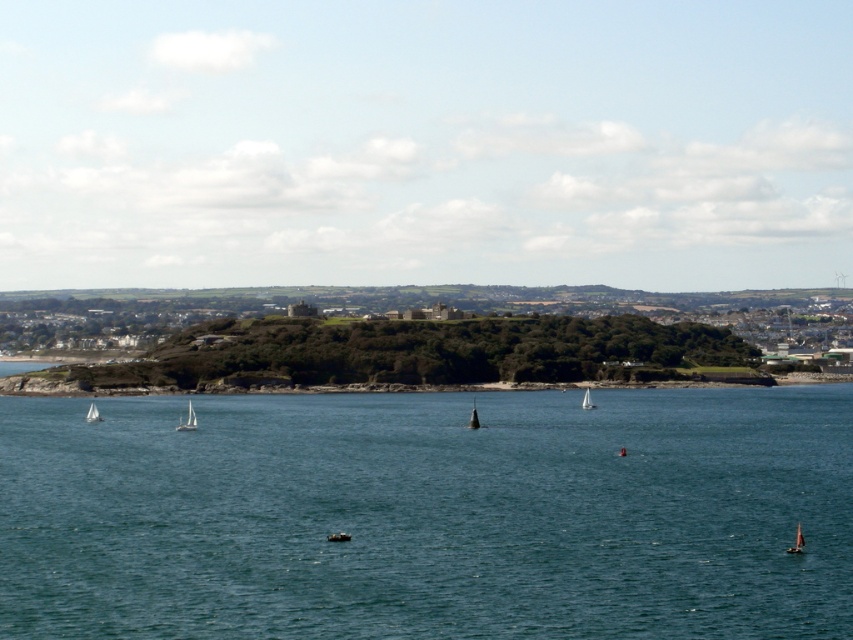
Question: Is black matte sailboat at center behind white sailboat at center?

Choices:
 (A) yes
 (B) no

Answer: (B)

Question: Considering the real-world distances, which object is closest to the white sailboat at center?

Choices:
 (A) red sailboat at lower right
 (B) white matte sailboat at lower left
 (C) black matte sailboat at center
 (D) white matte sailboat at center-left

Answer: (C)

Question: Can you confirm if clear blue water at center is positioned to the left of black matte sailboat at center?

Choices:
 (A) no
 (B) yes

Answer: (B)

Question: Which of these objects is positioned farthest from the red sailboat at lower right?

Choices:
 (A) clear blue water at center
 (B) white matte sailboat at lower left

Answer: (B)

Question: Among these objects, which one is farthest from the camera?

Choices:
 (A) black matte sailboat at center
 (B) white matte sailboat at center-left
 (C) red sailboat at lower right
 (D) white sailboat at center

Answer: (D)

Question: Is clear blue water at center bigger than red sailboat at lower right?

Choices:
 (A) no
 (B) yes

Answer: (B)